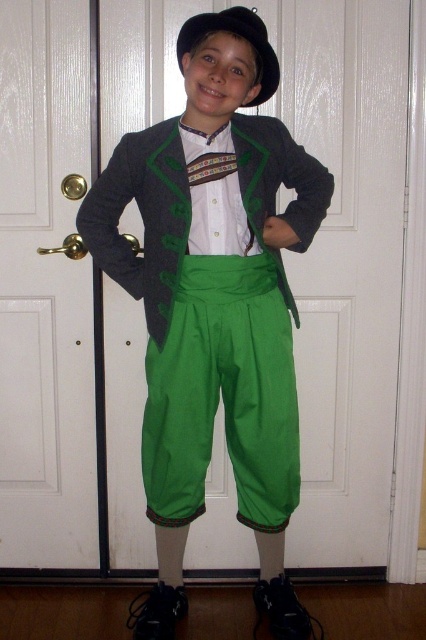
You are a tailor measuring a young boy for a new suit. You need to determine if the jacket and hat can be stored together in a box that is 30 centimeters tall. Based on the distance between the dark gray wool jacket at center and the black felt hat at upper center, will they fit vertically in the box?

The distance between the dark gray wool jacket at center and the black felt hat at upper center is 29.21 centimeters. Since the box is 30 centimeters tall, they will fit vertically in the box as the total height required is less than the box height.

You are a tailor observing a boy dressed in traditional attire. You need to adjust the length of the matte green pants at center and the dark gray wool jacket at center. Which clothing item is closer to the left side of the boy to make the adjustment?

The matte green pants at center is positioned on the left side of the dark gray wool jacket at center, so the tailor should adjust the matte green pants at center first as it is closer to the left.

You are a tailor who needs to adjust the length of the matte green pants at center and the black felt hat at upper center. Which item requires a longer adjustment in terms of vertical height?

The matte green pants at center is much taller than the black felt hat at upper center, so the pants would require a longer adjustment in terms of vertical height.